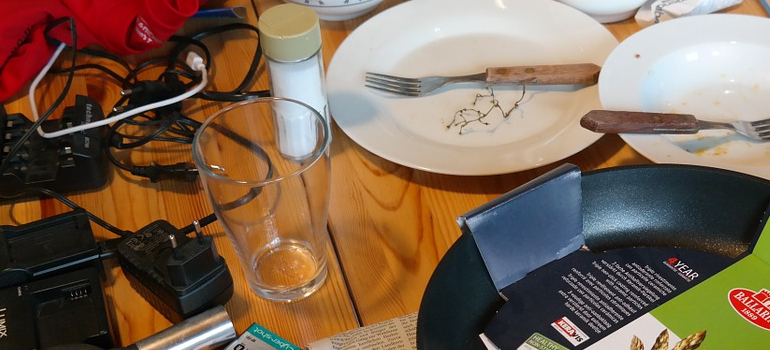
This screenshot has width=770, height=350. In order to click on black cord in this screenshot , I will do `click(173, 115)`.